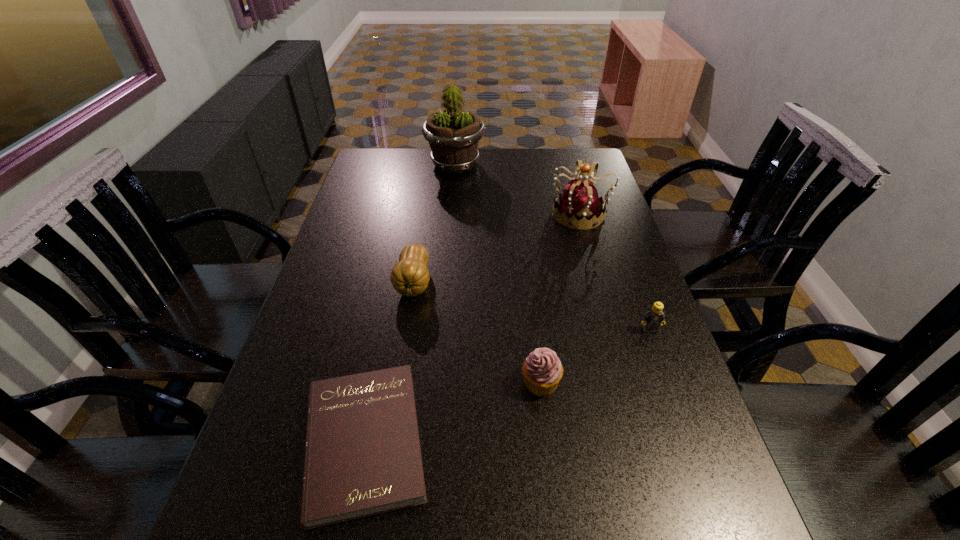
The image size is (960, 540). What are the coordinates of `vacant space located on the front-facing side of the fifth nearest object` in the screenshot? It's located at coord(443,214).

Where is `free region located 0.180m on the front-facing side of the fifth nearest object`? This screenshot has height=540, width=960. free region located 0.180m on the front-facing side of the fifth nearest object is located at coordinates (494, 214).

Identify the location of free space located on the back of the third object from right to left. This screenshot has width=960, height=540. (528, 271).

The width and height of the screenshot is (960, 540). Find the location of `vacant space located on the stem side of the third farthest object`. vacant space located on the stem side of the third farthest object is located at coordinates (397, 383).

Locate an element on the screen. This screenshot has width=960, height=540. vacant space located 0.190m in front of the third nearest object is located at coordinates (676, 403).

You are a GUI agent. You are given a task and a screenshot of the screen. Output one action in this format:
    pyautogui.click(x=<x>, y=<y>)
    Task: Click on the vacant position located on the back of the shortest object
    Image resolution: width=960 pixels, height=540 pixels.
    Given the screenshot: What is the action you would take?
    pyautogui.click(x=393, y=303)

At what (x,y) coordinates should I click in order to perform the action: click on object that is positioned at the far edge. Please return your answer as a coordinate pair (x, y). Looking at the image, I should click on (453, 135).

You are a GUI agent. You are given a task and a screenshot of the screen. Output one action in this format:
    pyautogui.click(x=<x>, y=<y>)
    Task: Click on the object at the left edge
    
    Given the screenshot: What is the action you would take?
    pyautogui.click(x=362, y=457)

The image size is (960, 540). I want to click on tiara that is at the right edge, so tap(580, 204).

Locate an element on the screen. Lego that is positioned at the right edge is located at coordinates (x=654, y=317).